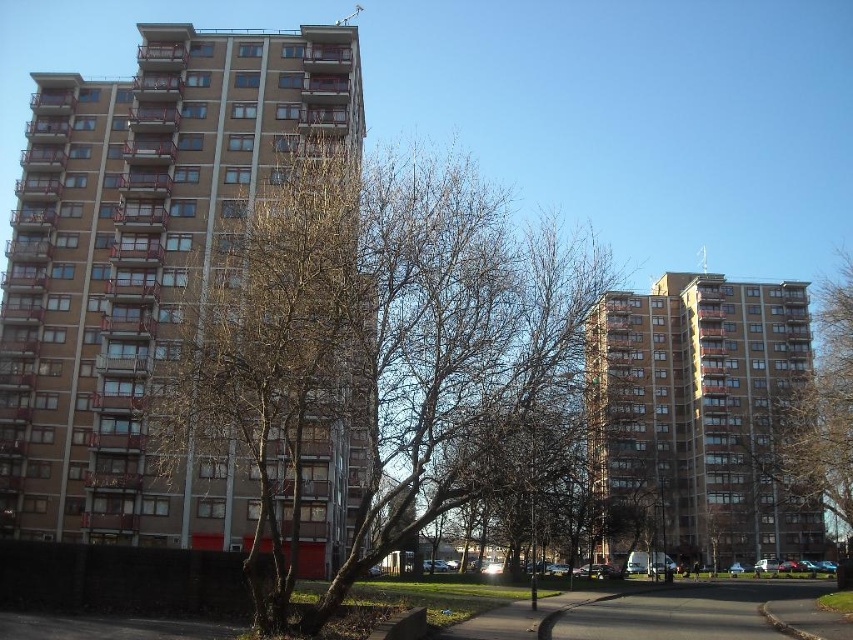
Question: Which of the following is the closest to the observer?

Choices:
 (A) brown concrete building at center
 (B) bare branches at right
 (C) bare branches at center

Answer: (C)

Question: Which of the following is the farthest from the observer?

Choices:
 (A) bare branches at right
 (B) brown leafless tree at left
 (C) brown concrete building at center
 (D) brown concrete building at left

Answer: (A)

Question: Is bare branches at center behind brown concrete building at center?

Choices:
 (A) yes
 (B) no

Answer: (B)

Question: Is brown leafless tree at left wider than bare branches at right?

Choices:
 (A) yes
 (B) no

Answer: (A)

Question: Does brown leafless tree at left appear over brown concrete building at center?

Choices:
 (A) no
 (B) yes

Answer: (B)

Question: Which object is closer to the camera taking this photo?

Choices:
 (A) brown leafless tree at left
 (B) brown concrete building at left

Answer: (A)